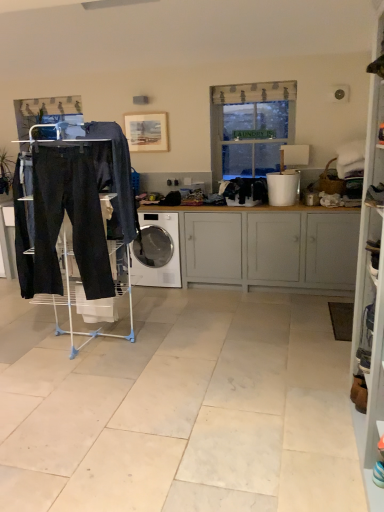
In the scene shown: Measure the distance between point (124, 173) and camera.

The distance of point (124, 173) from camera is 3.29 meters.

This screenshot has width=384, height=512. What do you see at coordinates (157, 251) in the screenshot?
I see `white glossy washing machine at center` at bounding box center [157, 251].

Image resolution: width=384 pixels, height=512 pixels. I want to click on translucent fabric window at center, so click(250, 127).

Describe the element at coordinates (270, 247) in the screenshot. I see `white painted wood cabinet at center` at that location.

At what (x,y) coordinates should I click in order to perform the action: click on dark gray fabric pants at center, which appears as the 1th clothing when viewed from the left. Please return your answer as a coordinate pair (x, y). The height and width of the screenshot is (512, 384). Looking at the image, I should click on (118, 172).

From the image's perspective, is translucent fabric window at center beneath white glossy washing machine at center?

No, from the image's perspective, translucent fabric window at center is not beneath white glossy washing machine at center.

From a real-world perspective, is translucent fabric window at center on white glossy washing machine at center?

Yes, from a real-world perspective, translucent fabric window at center is on top of white glossy washing machine at center.

Based on their positions, is translucent fabric window at center located to the left or right of white glossy washing machine at center?

Based on their positions, translucent fabric window at center is located to the right of white glossy washing machine at center.

Is dark gray fabric pants at center, marked as the second clothing in a back-to-front arrangement, aimed at white plastic bucket at right?

No, dark gray fabric pants at center, marked as the second clothing in a back-to-front arrangement, is not facing towards white plastic bucket at right.

Does dark gray fabric pants at center, which appears as the 1th clothing when viewed from the left, have a greater width compared to white plastic bucket at right?

No.

From the image's perspective, is dark gray fabric pants at center, marked as the second clothing in a back-to-front arrangement, above white plastic bucket at right?

Incorrect, from the image's perspective, dark gray fabric pants at center, marked as the second clothing in a back-to-front arrangement, is lower than white plastic bucket at right.

Between matte black drying rack at left and wooden frame at upper center, which one has more height?

matte black drying rack at left is taller.

Between matte black drying rack at left and wooden frame at upper center, which one has smaller size?

Smaller between the two is wooden frame at upper center.

Measure the distance between matte black drying rack at left and wooden frame at upper center.

matte black drying rack at left is 1.90 meters away from wooden frame at upper center.

From the picture: Is white glossy washing machine at center wider than matte black drying rack at left?

Incorrect, the width of white glossy washing machine at center does not surpass that of matte black drying rack at left.

How different are the orientations of white glossy washing machine at center and matte black drying rack at left in degrees?

There is a 3.28-degree angle between the facing directions of white glossy washing machine at center and matte black drying rack at left.

Based on their sizes in the image, would you say white glossy washing machine at center is bigger or smaller than matte black drying rack at left?

Clearly, white glossy washing machine at center is smaller in size than matte black drying rack at left.

Based on their sizes in the image, would you say white plastic bucket at right is bigger or smaller than white painted wood cabinet at center?

white plastic bucket at right is smaller than white painted wood cabinet at center.

In the scene shown: Which object is wider, white plastic bucket at right or white painted wood cabinet at center?

With larger width is white painted wood cabinet at center.

Is white plastic bucket at right far from white painted wood cabinet at center?

No, there isn't a large distance between white plastic bucket at right and white painted wood cabinet at center.

Could you tell me if white plastic bucket at right is facing white painted wood cabinet at center?

No.

From a real-world perspective, is white painted wood cabinet at center on black fabric clothes at center, which appears as the 1th clothing when viewed from the back?

No, from a real-world perspective, white painted wood cabinet at center is not above black fabric clothes at center, which appears as the 1th clothing when viewed from the back.

How many degrees apart are the facing directions of white painted wood cabinet at center and black fabric clothes at center, which is the 1th clothing in right-to-left order?

The angular difference between white painted wood cabinet at center and black fabric clothes at center, which is the 1th clothing in right-to-left order, is 0.23 degrees.

Is white painted wood cabinet at center taller than black fabric clothes at center, which is the 1th clothing in right-to-left order?

Indeed, white painted wood cabinet at center has a greater height compared to black fabric clothes at center, which is the 1th clothing in right-to-left order.

Would you consider white painted wood cabinet at center to be distant from black fabric clothes at center, which appears as the 2th clothing when viewed from the left?

No, white painted wood cabinet at center is in close proximity to black fabric clothes at center, which appears as the 2th clothing when viewed from the left.

Is dark gray fabric pants at center, marked as the second clothing in a back-to-front arrangement, in front of or behind white painted wood cabinet at center in the image?

In the image, dark gray fabric pants at center, marked as the second clothing in a back-to-front arrangement, appears in front of white painted wood cabinet at center.

This screenshot has width=384, height=512. There is a white painted wood cabinet at center. In order to click on the 1st clothing above it (from the image's perspective) in this screenshot , I will do `click(118, 172)`.

Would you consider dark gray fabric pants at center, which is the 1th clothing in front-to-back order, to be distant from white painted wood cabinet at center?

dark gray fabric pants at center, which is the 1th clothing in front-to-back order, is far away from white painted wood cabinet at center.

Is point (116, 126) behind point (249, 259)?

No, it is not.

Locate an element on the screen. Image resolution: width=384 pixels, height=512 pixels. window behind the white glossy washing machine at center is located at coordinates (250, 127).

What are the coordinates of `clothing that appears in front of the white plastic bucket at right` in the screenshot? It's located at (118, 172).

Estimate the real-world distances between objects in this image. Which object is closer to matte black drying rack at left, translucent fabric window at center or white plastic bucket at right?

translucent fabric window at center is positioned closer to the anchor matte black drying rack at left.

Estimate the real-world distances between objects in this image. Which object is closer to white glossy washing machine at center, black fabric clothes at center, which appears as the 2th clothing when viewed from the left, or wooden frame at upper center?

black fabric clothes at center, which appears as the 2th clothing when viewed from the left.

Based on their spatial positions, is wooden frame at upper center or white glossy washing machine at center further from matte black drying rack at left?

The object further to matte black drying rack at left is wooden frame at upper center.

Which object lies further to the anchor point white painted wood cabinet at center, white plastic bucket at right or dark gray fabric pants at center, which ranks as the 2th clothing in right-to-left order?

dark gray fabric pants at center, which ranks as the 2th clothing in right-to-left order, is further to white painted wood cabinet at center.

Looking at the image, which one is located closer to wooden frame at upper center, white glossy washing machine at center or matte black drying rack at left?

Among the two, white glossy washing machine at center is located nearer to wooden frame at upper center.

In the scene shown: Which object lies nearer to the anchor point black fabric clothes at center, which appears as the 1th clothing when viewed from the back, dark gray fabric pants at center, which appears as the 1th clothing when viewed from the left, or white plastic bucket at right?

The object closer to black fabric clothes at center, which appears as the 1th clothing when viewed from the back, is white plastic bucket at right.

Looking at the image, which one is located closer to white painted wood cabinet at center, wooden frame at upper center or dark gray fabric pants at center, which appears as the 1th clothing when viewed from the left?

dark gray fabric pants at center, which appears as the 1th clothing when viewed from the left.

Looking at the image, which one is located closer to translucent fabric window at center, dark gray fabric pants at center, which is the 1th clothing in front-to-back order, or black fabric clothes at center, positioned as the second clothing in front-to-back order?

black fabric clothes at center, positioned as the second clothing in front-to-back order, is closer to translucent fabric window at center.

Locate an element on the screen. The height and width of the screenshot is (512, 384). cabinetry between translucent fabric window at center and white glossy washing machine at center in the up-down direction is located at coordinates pos(270,247).

You are a GUI agent. You are given a task and a screenshot of the screen. Output one action in this format:
    pyautogui.click(x=<x>, y=<y>)
    Task: Click on the cabinetry positioned between dark gray fabric pants at center, which appears as the 1th clothing when viewed from the left, and translucent fabric window at center from near to far
    
    Given the screenshot: What is the action you would take?
    pyautogui.click(x=270, y=247)

At what (x,y) coordinates should I click in order to perform the action: click on clothing located between white glossy washing machine at center and white painted wood cabinet at center in the left-right direction. Please return your answer as a coordinate pair (x, y). Image resolution: width=384 pixels, height=512 pixels. Looking at the image, I should click on (246, 191).

Find the location of a particular element. appliance between translucent fabric window at center and black fabric clothes at center, positioned as the second clothing in front-to-back order, in the vertical direction is located at coordinates [x=283, y=188].